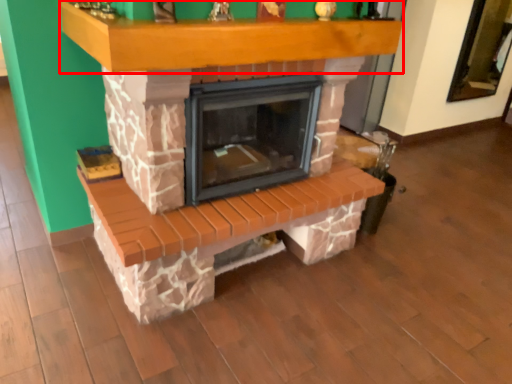
Question: In this image, where is mantle (annotated by the red box) located relative to fireplace?

Choices:
 (A) left
 (B) right

Answer: (B)